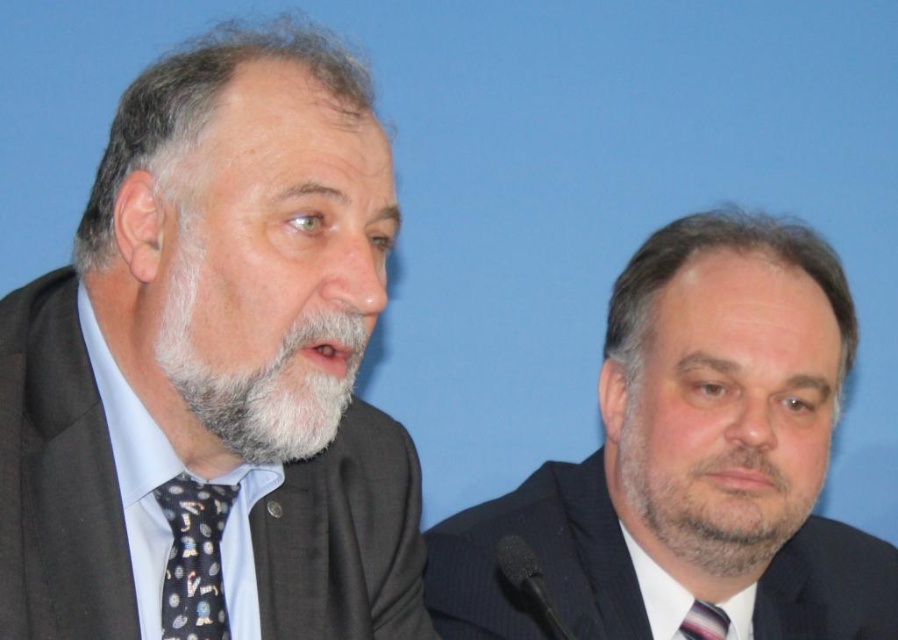
Question: Which object is closer to the camera taking this photo?

Choices:
 (A) matte black suit at left
 (B) dark suit at center
 (C) gray matte beard at left
 (D) black matte microphone at center

Answer: (A)

Question: Can you confirm if dark gray suit at center is thinner than striped fabric tie at center?

Choices:
 (A) yes
 (B) no

Answer: (B)

Question: Does gray matte beard at left have a smaller size compared to black dotted tie at left?

Choices:
 (A) yes
 (B) no

Answer: (B)

Question: Is gray matte beard at center to the left of striped fabric tie at center from the viewer's perspective?

Choices:
 (A) no
 (B) yes

Answer: (A)

Question: Which object appears closest to the camera in this image?

Choices:
 (A) striped fabric tie at center
 (B) dark gray suit at center
 (C) dark suit at center

Answer: (C)

Question: Estimate the real-world distances between objects in this image. Which object is farther from the dark suit at center?

Choices:
 (A) gray matte beard at center
 (B) black dotted tie at left

Answer: (B)